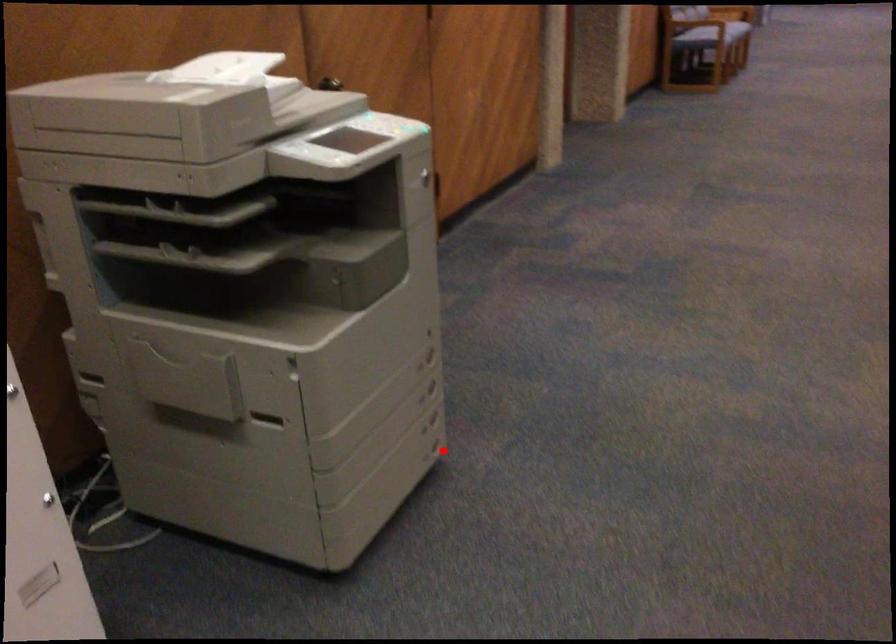
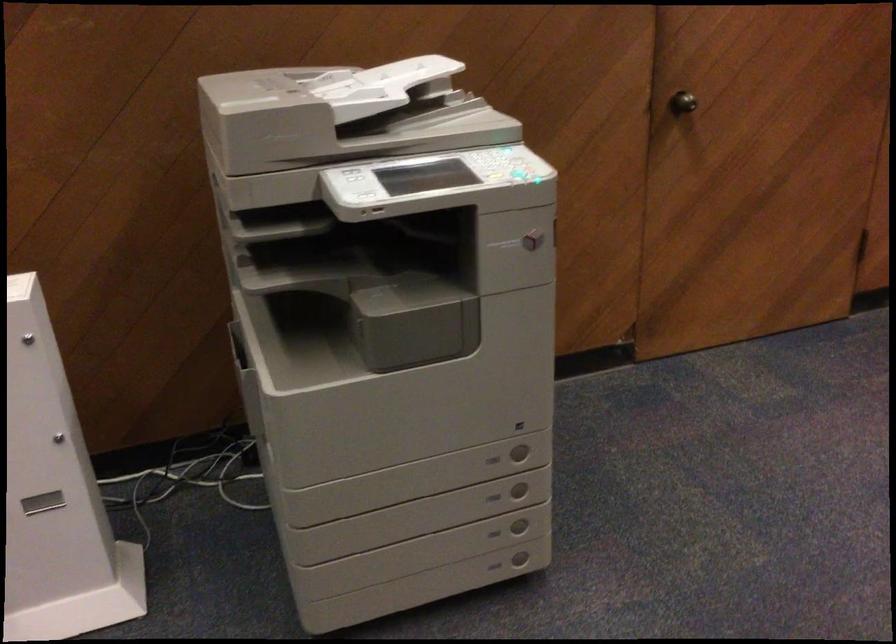
Where in the second image is the point corresponding to the highlighted location from the first image?

(520, 559)